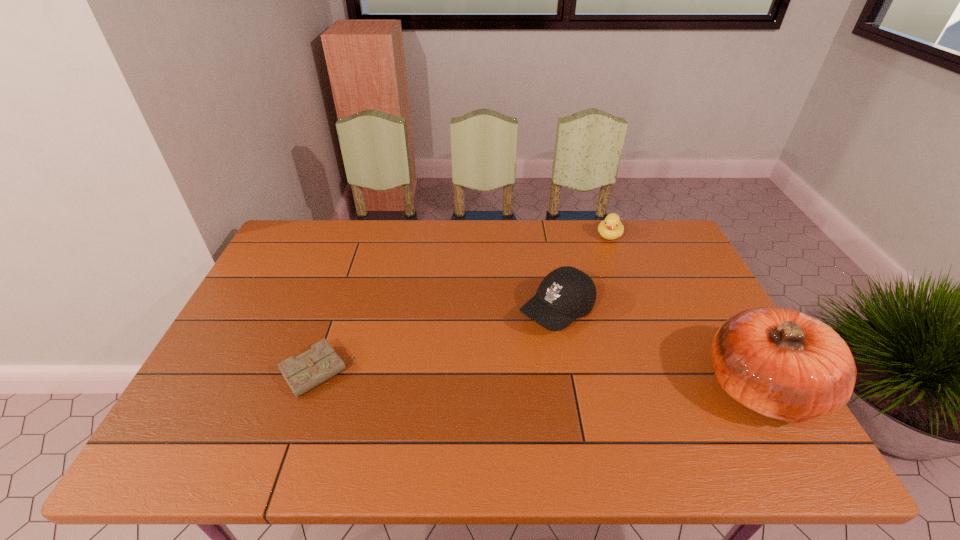
Image resolution: width=960 pixels, height=540 pixels. I want to click on the leftmost object, so click(311, 368).

Identify the location of diary. (311, 368).

Identify the location of pumpkin. (x=780, y=363).

I want to click on the tallest object, so click(x=780, y=363).

I want to click on baseball cap, so click(566, 293).

The height and width of the screenshot is (540, 960). I want to click on the second object from left to right, so click(566, 293).

You are a GUI agent. You are given a task and a screenshot of the screen. Output one action in this format:
    pyautogui.click(x=<x>, y=<y>)
    Task: Click on the farthest object
    This screenshot has height=540, width=960.
    Given the screenshot: What is the action you would take?
    pyautogui.click(x=611, y=228)

Find the location of a particular element. the third tallest object is located at coordinates (611, 228).

The image size is (960, 540). I want to click on free space located 0.300m on the back of the diary, so click(x=351, y=273).

Image resolution: width=960 pixels, height=540 pixels. I want to click on vacant position located on the left of the pumpkin, so click(564, 387).